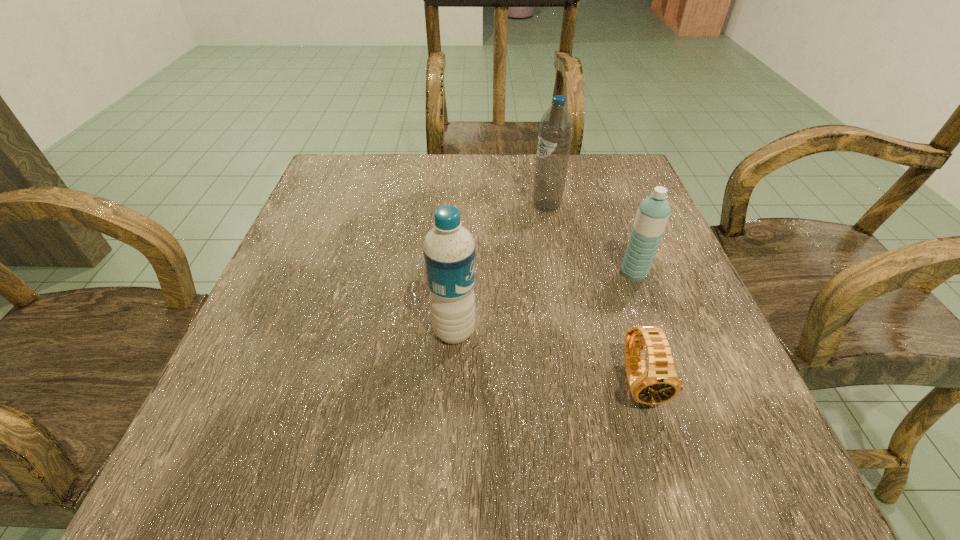
Locate an element on the screen. This screenshot has width=960, height=540. free spot located on the front of the third tallest object is located at coordinates (681, 402).

Where is `free space located 0.060m on the face of the shortest object`? free space located 0.060m on the face of the shortest object is located at coordinates pos(662,456).

At what (x,y) coordinates should I click in order to perform the action: click on object present at the far edge. Please return your answer as a coordinate pair (x, y). This screenshot has width=960, height=540. Looking at the image, I should click on (555, 132).

At what (x,y) coordinates should I click in order to perform the action: click on water bottle that is at the right edge. Please return your answer as a coordinate pair (x, y). The image size is (960, 540). Looking at the image, I should click on (653, 213).

Locate an element on the screen. watch at the right edge is located at coordinates (659, 383).

Locate an element on the screen. free space at the far edge of the desktop is located at coordinates (453, 187).

This screenshot has width=960, height=540. In the image, there is a desktop. Find the location of `vacant region at the near edge`. vacant region at the near edge is located at coordinates (357, 472).

Locate an element on the screen. The height and width of the screenshot is (540, 960). vacant space at the left edge is located at coordinates (310, 345).

Find the location of a particular element. This screenshot has width=960, height=540. vacant area at the right edge of the desktop is located at coordinates (642, 412).

This screenshot has height=540, width=960. I want to click on vacant space at the far left corner, so click(348, 162).